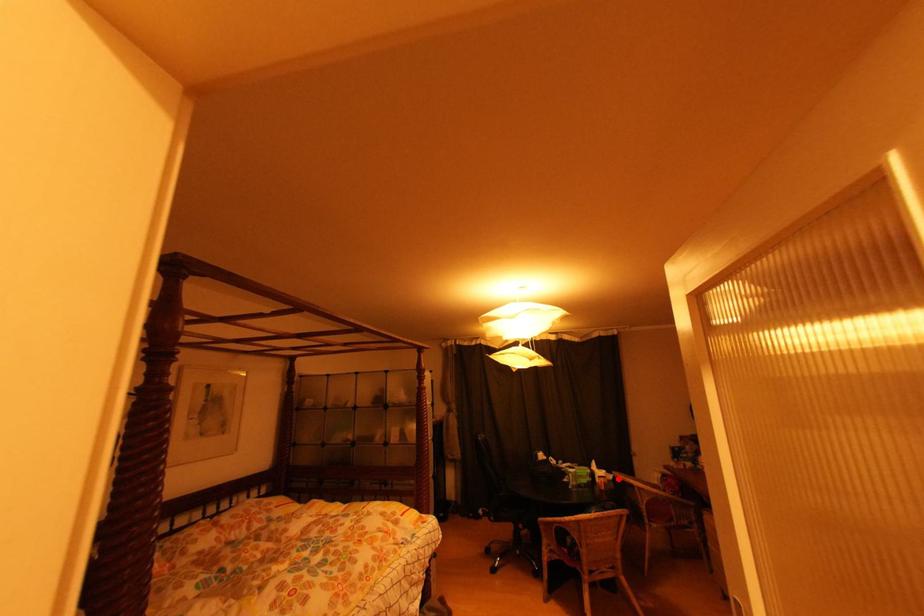
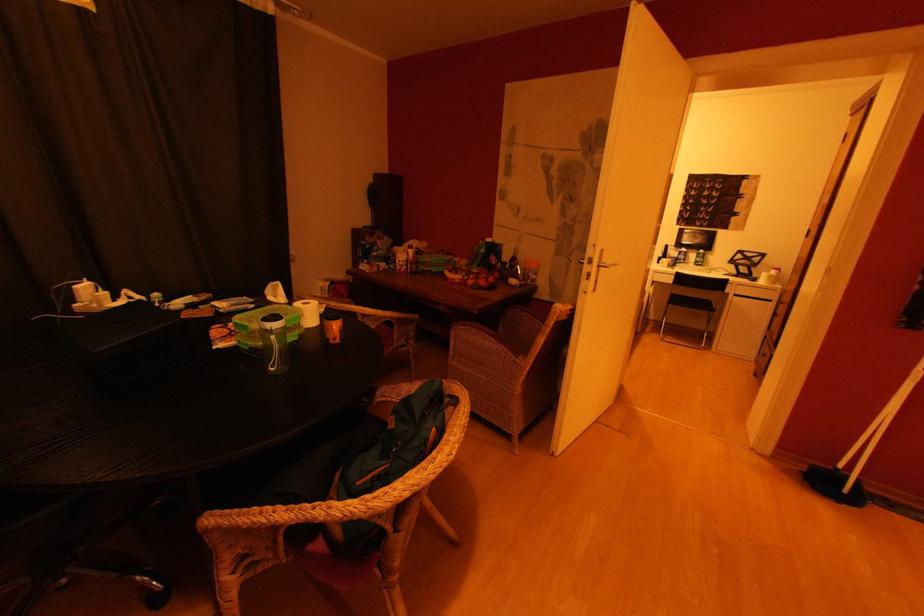
Question: I am providing you with two images of the same scene from different viewpoints. In image1, a red point is highlighted. Considering the same 3D point in image2, which of the following is correct?

Choices:
 (A) It is closer
 (B) It is farther

Answer: (A)